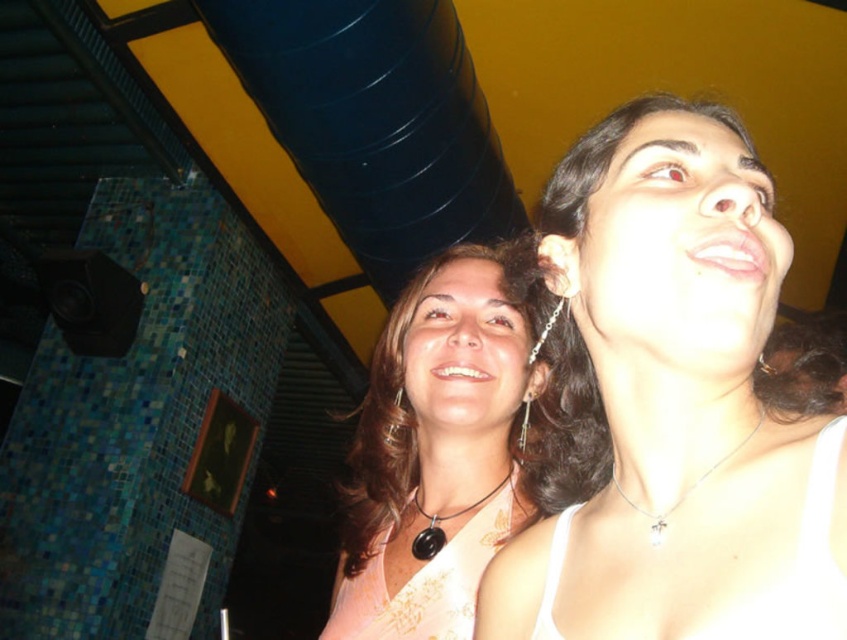
Is pink fabric at center thinner than silver metallic necklace at upper center?

In fact, pink fabric at center might be wider than silver metallic necklace at upper center.

Who is more forward, (435, 452) or (751, 428)?

Point (751, 428)

Who is more distant from viewer, (521,481) or (629,506)?

The point (521,481) is more distant.

Image resolution: width=847 pixels, height=640 pixels. I want to click on pink fabric at center, so click(439, 451).

Is silver metallic necklace at upper center to the left of black leather necklace at center from the viewer's perspective?

In fact, silver metallic necklace at upper center is to the right of black leather necklace at center.

Can you confirm if silver metallic necklace at upper center is taller than black leather necklace at center?

Incorrect, silver metallic necklace at upper center's height is not larger of black leather necklace at center's.

This screenshot has width=847, height=640. What do you see at coordinates (684, 488) in the screenshot?
I see `silver metallic necklace at upper center` at bounding box center [684, 488].

Find the location of a particular element. This screenshot has height=640, width=847. silver metallic necklace at upper center is located at coordinates (684, 488).

Who is shorter, white matte tank top at upper right or pink fabric at center?

Standing shorter between the two is white matte tank top at upper right.

Is white matte tank top at upper right smaller than pink fabric at center?

Correct, white matte tank top at upper right occupies less space than pink fabric at center.

Between point (494, 604) and point (380, 355), which one is positioned behind?

The point (380, 355) is more distant.

The width and height of the screenshot is (847, 640). Find the location of `white matte tank top at upper right`. white matte tank top at upper right is located at coordinates (673, 403).